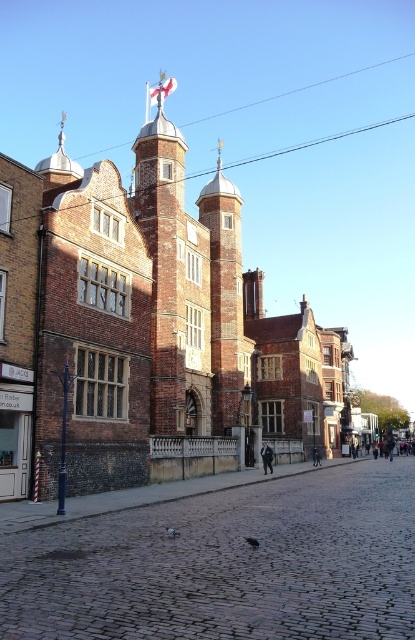
Is point (227, 364) in front of point (265, 474)?

No, it is not.

Describe the element at coordinates (226, 300) in the screenshot. I see `brick bell tower at center` at that location.

Find the location of a particular element. The width and height of the screenshot is (415, 640). brick bell tower at center is located at coordinates (226, 300).

The image size is (415, 640). In order to click on brick bell tower at center in this screenshot , I will do `click(226, 300)`.